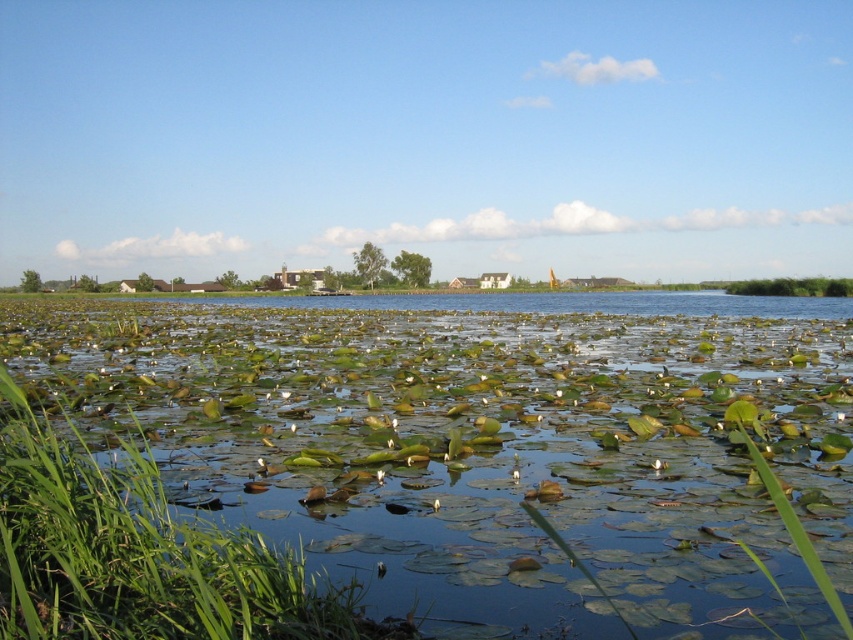
Who is positioned more to the left, green leafy pond at center or green leafy vegetation at right?

green leafy pond at center

Is green leafy pond at center positioned behind green leafy vegetation at right?

No, it is in front of green leafy vegetation at right.

Which is behind, point (685, 310) or point (769, 292)?

The point (769, 292) is more distant.

At what (x,y) coordinates should I click in order to perform the action: click on green leafy pond at center. Please return your answer as a coordinate pair (x, y). Looking at the image, I should click on (490, 445).